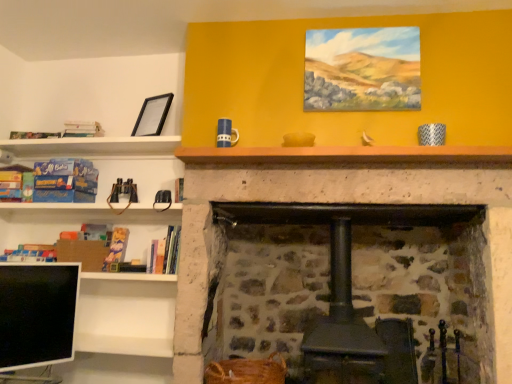
Question: Is hardcover book at left, which ranks as the 2th book in left-to-right order, a part of hardcover book at left, the first book when ordered from right to left?

Choices:
 (A) yes
 (B) no

Answer: (B)

Question: Does hardcover book at left, which is the seventh book from left to right, lie in front of hardcover book at left, which ranks as the 2th book in left-to-right order?

Choices:
 (A) no
 (B) yes

Answer: (B)

Question: From the image's perspective, would you say hardcover book at left, the first book when ordered from right to left, is positioned over hardcover book at left, which ranks as the 2th book in left-to-right order?

Choices:
 (A) yes
 (B) no

Answer: (A)

Question: Considering the relative positions of hardcover book at left, which is the seventh book from left to right, and hardcover book at left, which ranks as the 2th book in left-to-right order, in the image provided, is hardcover book at left, which is the seventh book from left to right, to the left of hardcover book at left, which ranks as the 2th book in left-to-right order, from the viewer's perspective?

Choices:
 (A) yes
 (B) no

Answer: (B)

Question: Is hardcover book at left, which is the seventh book from left to right, completely or partially outside of hardcover book at left, which ranks as the 2th book in left-to-right order?

Choices:
 (A) no
 (B) yes

Answer: (B)

Question: Choose the correct answer: Is hardcover book at left, which ranks as the 2th book in left-to-right order, inside matte blue book at left, which is the 1th book from left to right, or outside it?

Choices:
 (A) inside
 (B) outside

Answer: (B)

Question: Is hardcover book at left, which appears as the 6th book when viewed from the right, in front of or behind matte blue book at left, which is the 1th book from left to right, in the image?

Choices:
 (A) behind
 (B) front

Answer: (B)

Question: Considering the positions of hardcover book at left, which appears as the 6th book when viewed from the right, and matte blue book at left, which is the 1th book from left to right, in the image, is hardcover book at left, which appears as the 6th book when viewed from the right, taller or shorter than matte blue book at left, which is the 1th book from left to right,?

Choices:
 (A) tall
 (B) short

Answer: (B)

Question: Considering the positions of point (27, 251) and point (1, 177), is point (27, 251) closer or farther from the camera than point (1, 177)?

Choices:
 (A) closer
 (B) farther

Answer: (B)

Question: Based on their sizes in the image, would you say hardcover book at left, the first book when ordered from right to left, is bigger or smaller than hardcover book at left, which ranks as the 2th book in left-to-right order?

Choices:
 (A) big
 (B) small

Answer: (A)

Question: Relative to hardcover book at left, which appears as the 6th book when viewed from the right, is hardcover book at left, the first book when ordered from right to left, in front or behind?

Choices:
 (A) front
 (B) behind

Answer: (A)

Question: Considering the positions of point (176, 269) and point (26, 246), is point (176, 269) closer or farther from the camera than point (26, 246)?

Choices:
 (A) farther
 (B) closer

Answer: (B)

Question: From the image's perspective, is hardcover book at left, the first book when ordered from right to left, positioned above or below hardcover book at left, which appears as the 6th book when viewed from the right?

Choices:
 (A) above
 (B) below

Answer: (A)

Question: Is black glossy computer monitor at lower left situated inside hardcover book at left, the first book when ordered from right to left, or outside?

Choices:
 (A) outside
 (B) inside

Answer: (A)

Question: Considering the positions of point (61, 324) and point (170, 231), is point (61, 324) closer or farther from the camera than point (170, 231)?

Choices:
 (A) farther
 (B) closer

Answer: (B)